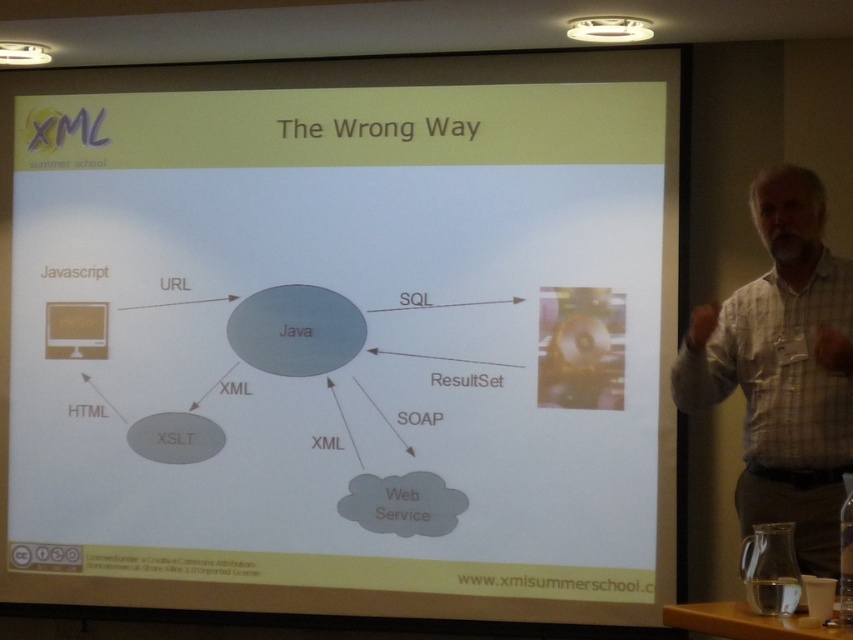
Can you confirm if white matte projector screen at upper center is shorter than white checkered shirt at right?

Incorrect, white matte projector screen at upper center's height does not fall short of white checkered shirt at right's.

Which is in front, point (57, 490) or point (756, 196)?

Point (756, 196) is in front.

Where is `white matte projector screen at upper center`? Image resolution: width=853 pixels, height=640 pixels. white matte projector screen at upper center is located at coordinates (341, 337).

Which is more to the left, white matte projector screen at upper center or metallic projector at upper left?

Positioned to the left is metallic projector at upper left.

Can you confirm if white matte projector screen at upper center is taller than metallic projector at upper left?

Yes.

Between point (143, 129) and point (36, 61), which one is positioned behind?

Point (143, 129)

What are the coordinates of `white matte projector screen at upper center` in the screenshot? It's located at [341, 337].

In the scene shown: Is white checkered shirt at right below metallic projector at upper left?

Correct, white checkered shirt at right is located below metallic projector at upper left.

Can you confirm if white checkered shirt at right is thinner than metallic projector at upper left?

In fact, white checkered shirt at right might be wider than metallic projector at upper left.

Does point (828, 372) come farther from viewer compared to point (6, 54)?

That is False.

I want to click on white checkered shirt at right, so click(782, 369).